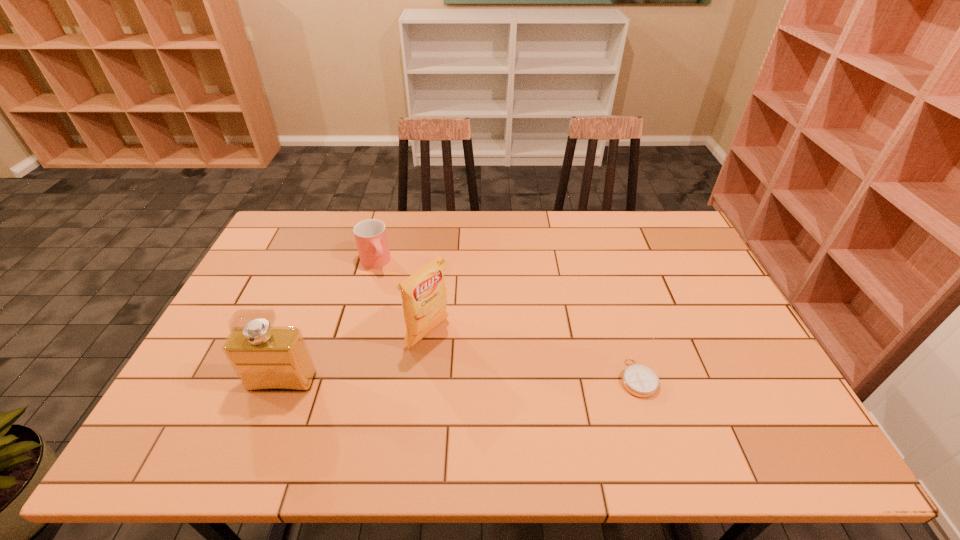
In the image, there is a desktop. At what (x,y) coordinates should I click in order to perform the action: click on vacant space at the near edge. Please return your answer as a coordinate pair (x, y). The height and width of the screenshot is (540, 960). Looking at the image, I should click on (405, 411).

In the image, there is a desktop. Identify the location of vacant area at the left edge. (276, 262).

You are a GUI agent. You are given a task and a screenshot of the screen. Output one action in this format:
    pyautogui.click(x=<x>, y=<y>)
    Task: Click on the free space at the right edge
    The width and height of the screenshot is (960, 540).
    Given the screenshot: What is the action you would take?
    pyautogui.click(x=732, y=332)

Locate an element on the screen. This screenshot has height=540, width=960. vacant space at the far right corner is located at coordinates (655, 217).

Identify the location of blank region between the second object from left to right and the leftmost object. (328, 322).

Where is `blank region between the second object from right to left and the leftmost object`? Image resolution: width=960 pixels, height=540 pixels. blank region between the second object from right to left and the leftmost object is located at coordinates (355, 358).

This screenshot has width=960, height=540. I want to click on free point between the leftmost object and the rightmost object, so click(x=460, y=380).

Find the location of a particular element. vacant space that is in between the leftmost object and the rightmost object is located at coordinates (460, 380).

Identify the location of vacant area that lies between the third nearest object and the perfume. This screenshot has height=540, width=960. (355, 358).

This screenshot has height=540, width=960. In order to click on free space between the third tallest object and the compass in this screenshot , I will do `click(506, 320)`.